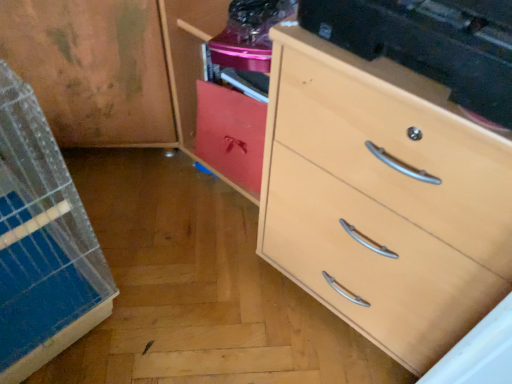
This screenshot has width=512, height=384. Find the location of `vacant space to the left of matte red cabinet at center`. vacant space to the left of matte red cabinet at center is located at coordinates (178, 183).